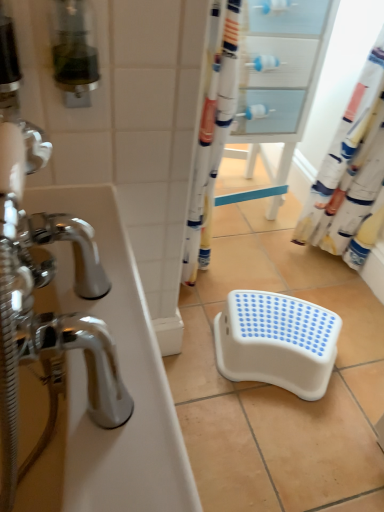
Question: In terms of height, does white glossy bathtub at left look taller or shorter compared to white plastic step stool at center?

Choices:
 (A) tall
 (B) short

Answer: (A)

Question: Considering the positions of point (158, 426) and point (261, 342), is point (158, 426) closer or farther from the camera than point (261, 342)?

Choices:
 (A) farther
 (B) closer

Answer: (B)

Question: Based on their relative distances, which object is farther from the white plastic step stool at center?

Choices:
 (A) white fabric shower curtain at right
 (B) white glossy bathtub at left
 (C) white glossy drawer at upper center

Answer: (C)

Question: Which of these objects is positioned farthest from the white glossy drawer at upper center?

Choices:
 (A) white plastic step stool at center
 (B) white glossy bathtub at left
 (C) white fabric shower curtain at right

Answer: (B)